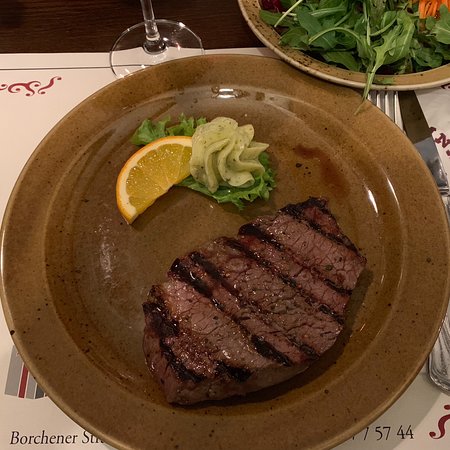
Where is `plate`? plate is located at coordinates (273, 102).